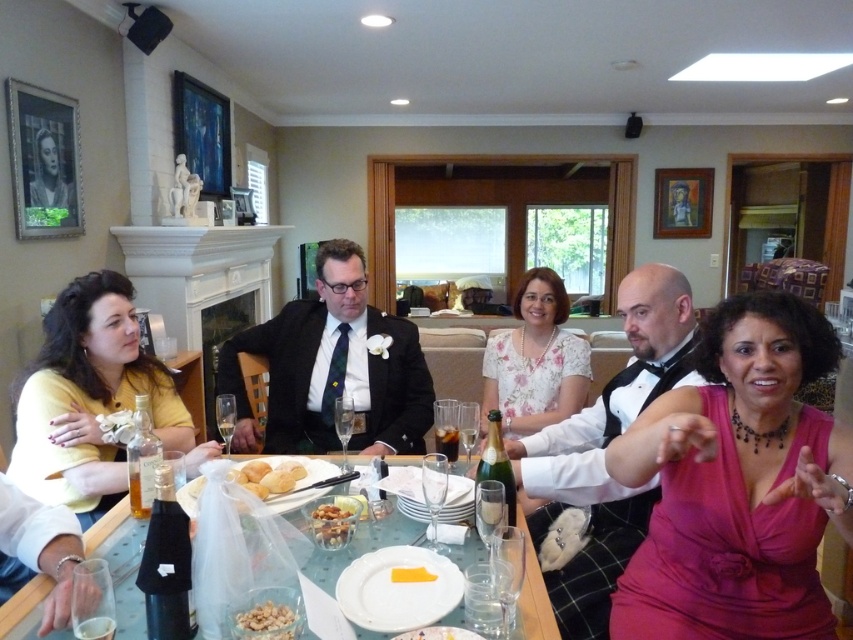
You are a photographer standing at the end of the table. You want to take a photo that includes both the matte black suit at center and the golden brown bread at center. Which object will appear larger in the photo?

The matte black suit at center will appear larger in the photo because it is taller than the golden brown bread at center.